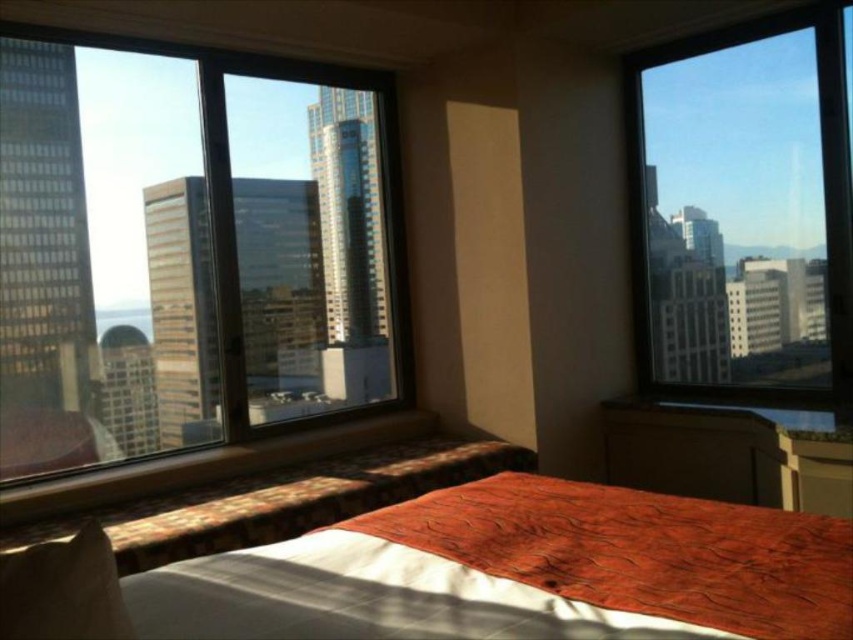
You are a guest in the hotel room and want to take a nap on the bed. You notice the white soft pillow at lower left and the transparent glass window at right. Which object is closer to you when lying on the bed?

The white soft pillow at lower left is behind the transparent glass window at right, so the window is closer to you when lying on the bed.

You are a hotel guest who wants to let in more sunlight into your room. Which window should you open, the transparent glass window at left or the transparent glass window at right?

The transparent glass window at left is bigger than the transparent glass window at right, so opening the transparent glass window at left will let in more sunlight.

You are standing in the center of the hotel room and want to look outside through the transparent glass window at right. Based on its position, can you estimate whether the window is closer to the left or right side of the room?

The transparent glass window at right is located at point 0.331 on the x and 0.875 on the y, which means it is closer to the right side of the room.